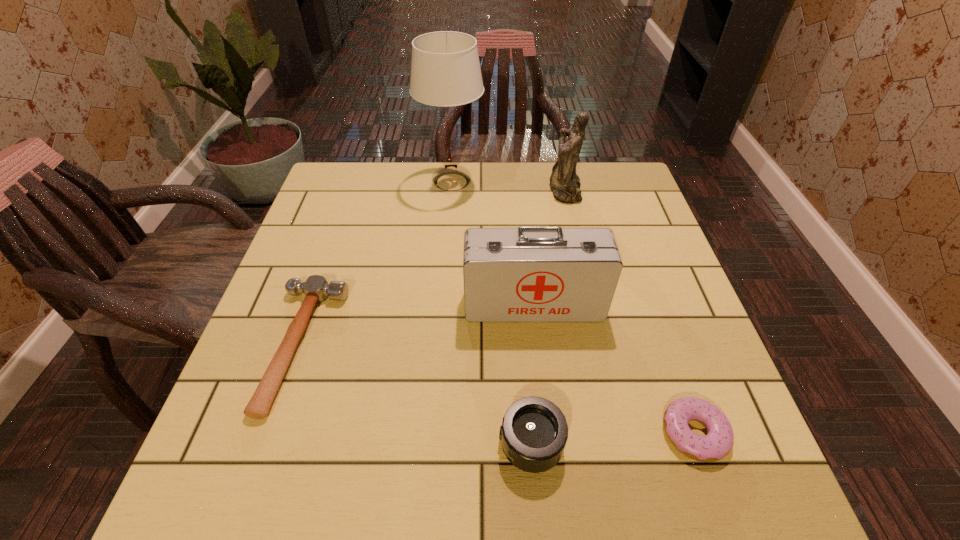
This screenshot has height=540, width=960. In order to click on vacant space located 0.390m on the front-facing side of the figurine in this screenshot , I will do `click(420, 190)`.

Find the location of a particular element. free space located 0.260m on the front-facing side of the figurine is located at coordinates (464, 190).

Locate an element on the screen. vacant space located on the front-facing side of the third tallest object is located at coordinates (550, 458).

This screenshot has width=960, height=540. In order to click on free region located on the side of the telephoto lens with brand markings and control switches in this screenshot , I will do `click(381, 444)`.

I want to click on blank space located on the side of the telephoto lens with brand markings and control switches, so click(403, 444).

Locate an element on the screen. vacant area situated 0.190m on the side of the telephoto lens with brand markings and control switches is located at coordinates (392, 444).

The height and width of the screenshot is (540, 960). I want to click on free space located 0.090m on the right of the hammer, so click(378, 346).

The image size is (960, 540). I want to click on vacant space located 0.060m on the left of the rightmost object, so click(x=629, y=433).

Where is `table lamp situated at the far edge`? This screenshot has height=540, width=960. table lamp situated at the far edge is located at coordinates click(445, 70).

Image resolution: width=960 pixels, height=540 pixels. I want to click on figurine located in the far edge section of the desktop, so click(x=565, y=184).